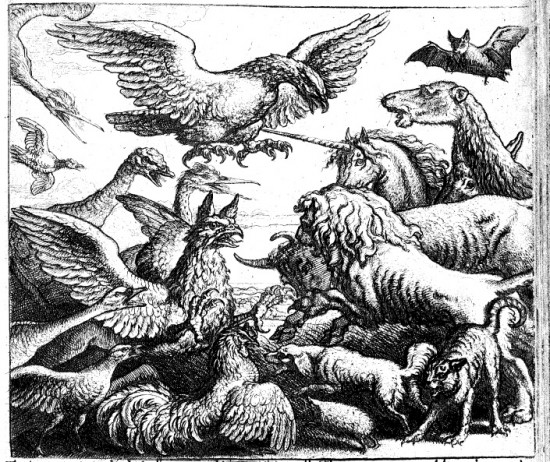
You are a GUI agent. You are given a task and a screenshot of the screen. Output one action in this format:
    pyautogui.click(x=<x>, y=<y>)
    Task: Click on the art
    This screenshot has width=550, height=462.
    Given the screenshot: What is the action you would take?
    coord(279,15)